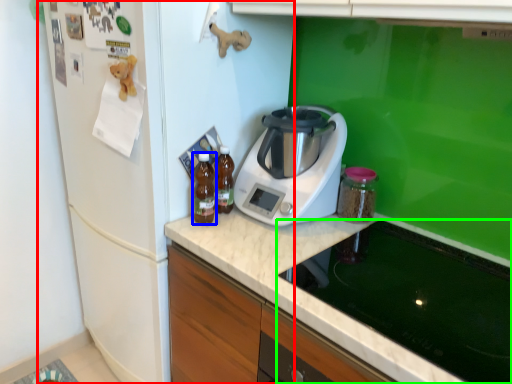
Question: Which object is positioned closest to fridge (highlighted by a red box)? Select from kitchen appliance (highlighted by a blue box) and home appliance (highlighted by a green box).

Choices:
 (A) kitchen appliance
 (B) home appliance

Answer: (A)